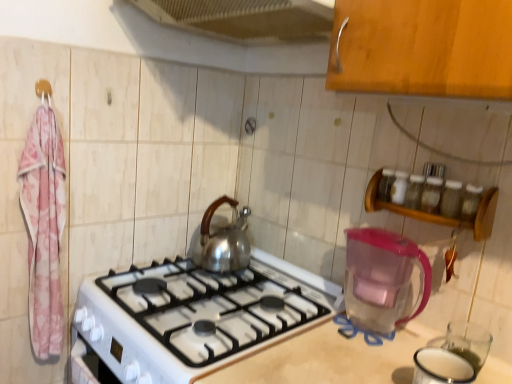
Question: Relative to wooden spice rack at upper right, is pink fabric hanger at upper left in front or behind?

Choices:
 (A) front
 (B) behind

Answer: (B)

Question: Would you say pink fabric hanger at upper left is to the left or to the right of wooden spice rack at upper right in the picture?

Choices:
 (A) left
 (B) right

Answer: (A)

Question: Which object is positioned farthest from the pink fabric hanger at upper left?

Choices:
 (A) white glossy gas stove at center
 (B) transparent plastic pitcher at lower right
 (C) white glossy oven at lower left
 (D) metallic mesh at upper center
 (E) silver metallic kettle at center

Answer: (B)

Question: Estimate the real-world distances between objects in this image. Which object is closer to the white glossy oven at lower left?

Choices:
 (A) metallic mesh at upper center
 (B) white glossy gas stove at center
 (C) pink fabric towel at left
 (D) transparent plastic pitcher at lower right
 (E) silver metallic kettle at center

Answer: (C)